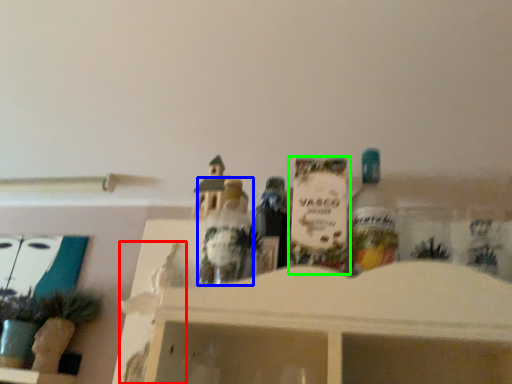
Question: Based on their relative distances, which object is farther from toy (highlighted by a red box)? Choose from toy (highlighted by a blue box) and toy (highlighted by a green box).

Choices:
 (A) toy
 (B) toy

Answer: (B)